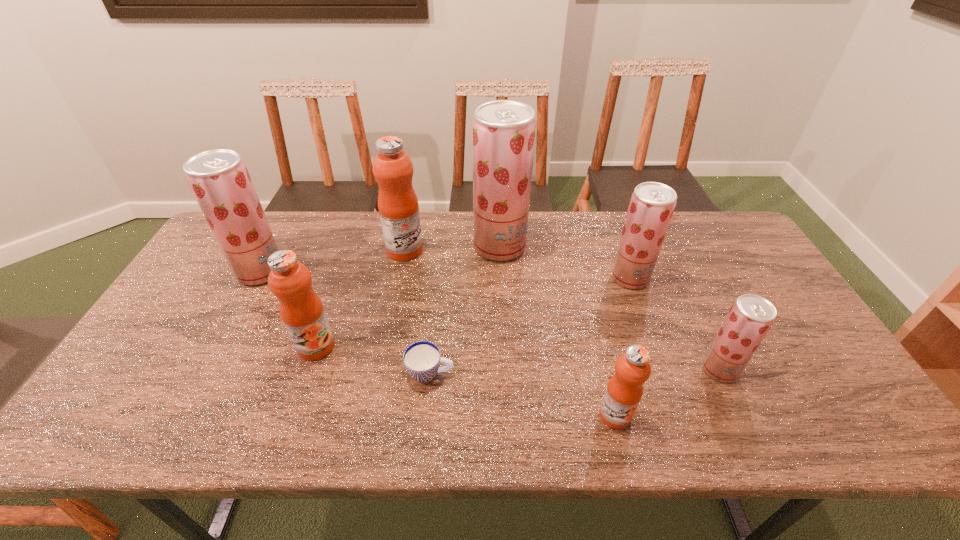
You are a GUI agent. You are given a task and a screenshot of the screen. Output one action in this format:
    pyautogui.click(x=<x>, y=<y>)
    Task: Click on the free space located on the front label of the second biggest orange fruit juice
    The height and width of the screenshot is (540, 960).
    Given the screenshot: What is the action you would take?
    pyautogui.click(x=297, y=404)

Identify the location of free location located 0.070m on the right of the rightmost object. (765, 369).

Where is `free space located 0.370m on the side of the cup with the handle`? This screenshot has width=960, height=540. free space located 0.370m on the side of the cup with the handle is located at coordinates (605, 373).

At what (x,y) coordinates should I click in order to perform the action: click on object present at the near edge. Please return your answer as a coordinate pair (x, y). Image resolution: width=960 pixels, height=540 pixels. Looking at the image, I should click on (624, 390).

Locate an element on the screen. This screenshot has height=540, width=960. object at the left edge is located at coordinates (219, 179).

Find the location of a particular element. vacant space at the far edge is located at coordinates (451, 212).

Where is `vacant area at the near edge of the desktop`? The width and height of the screenshot is (960, 540). vacant area at the near edge of the desktop is located at coordinates (686, 434).

Locate an element on the screen. This screenshot has width=960, height=540. vacant space at the left edge of the desktop is located at coordinates (142, 380).

Identify the location of vacant area at the right edge. (782, 322).

Where is `vacant space at the far left corner`? This screenshot has height=540, width=960. vacant space at the far left corner is located at coordinates (212, 255).